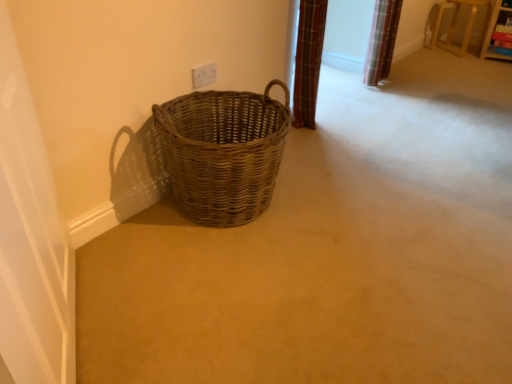
Identify the location of vacant region to the right of white glossy screen door at left. (195, 320).